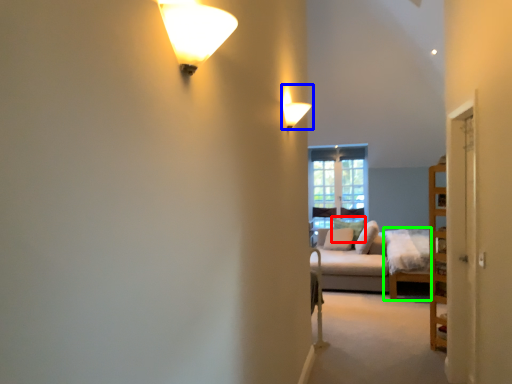
Question: Estimate the real-world distances between objects in this image. Which object is farther from pillow (highlighted by a red box), lamp (highlighted by a blue box) or couch (highlighted by a green box)?

Choices:
 (A) lamp
 (B) couch

Answer: (A)